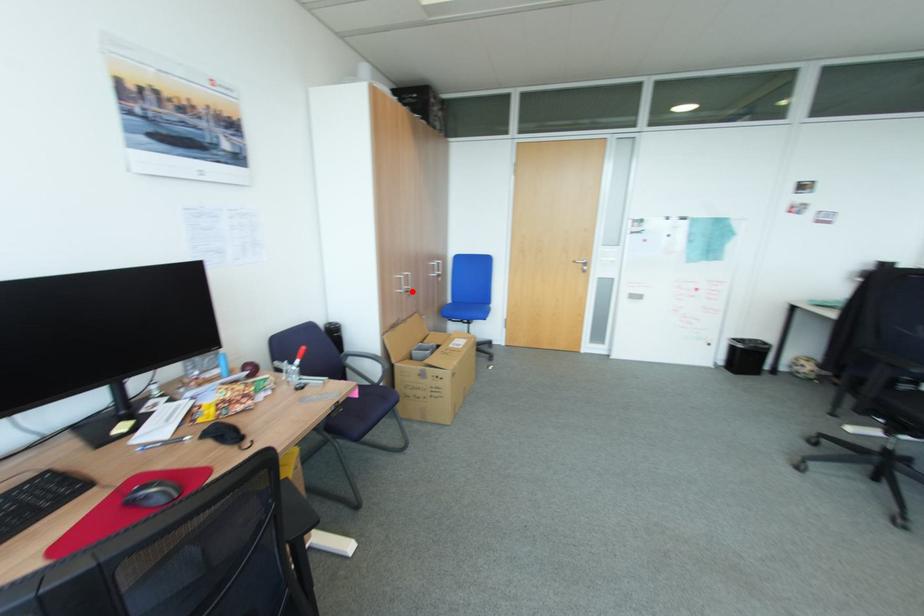
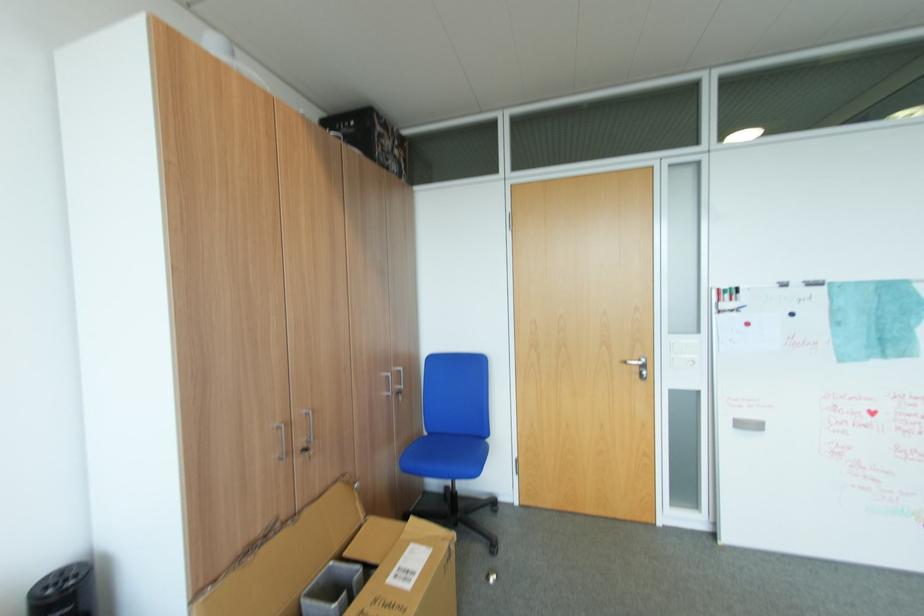
Locate, in the second image, the point that corresponds to the highlighted location in the first image.

(310, 451)